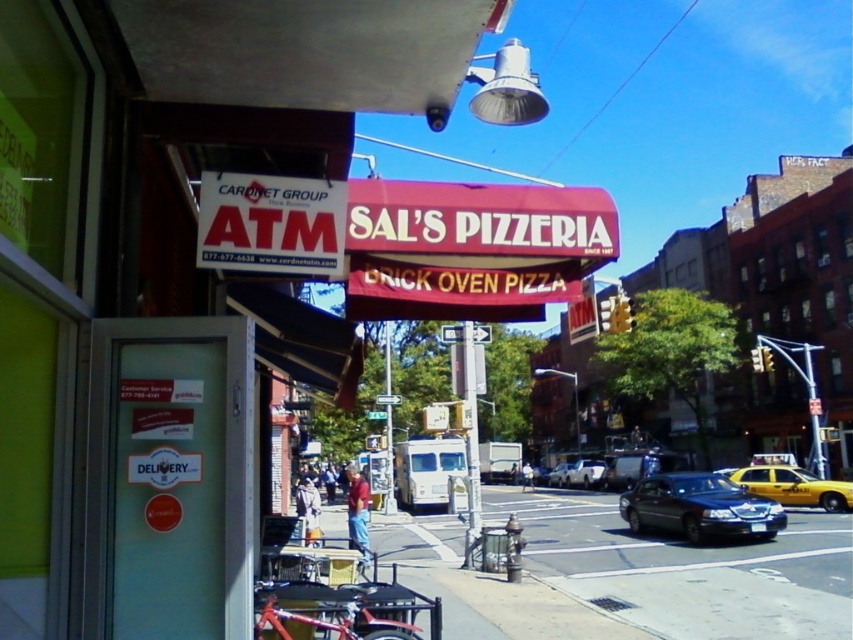
Question: In this image, where is smooth asphalt road at center located relative to silver metallic car at center?

Choices:
 (A) below
 (B) above

Answer: (B)

Question: Which object appears closest to the camera in this image?

Choices:
 (A) silver metallic car at center
 (B) black glossy sedan at center
 (C) yellow matte taxi at lower right
 (D) red brick oven pizza at center

Answer: (D)

Question: Which point is farther to the camera?

Choices:
 (A) (817, 520)
 (B) (253, 225)

Answer: (A)

Question: Does smooth asphalt road at center appear on the left side of white plastic atm at upper left?

Choices:
 (A) yes
 (B) no

Answer: (B)

Question: Considering the relative positions of red brick oven pizza at center and black glossy sedan at center in the image provided, where is red brick oven pizza at center located with respect to black glossy sedan at center?

Choices:
 (A) left
 (B) right

Answer: (A)

Question: Which point is closer to the camera?

Choices:
 (A) shiny black sedan at center
 (B) smooth asphalt road at center

Answer: (B)